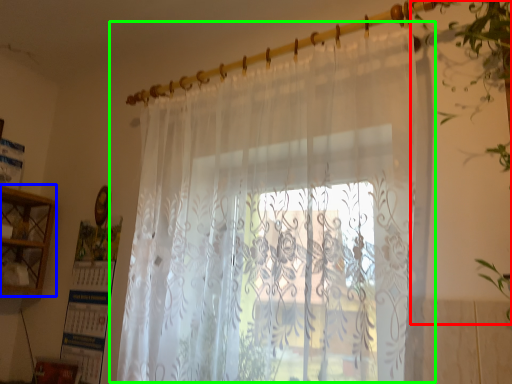
Question: Which object is the farthest from vegetation (highlighted by a red box)? Choose among these: cabinet (highlighted by a blue box) or curtain (highlighted by a green box).

Choices:
 (A) cabinet
 (B) curtain

Answer: (A)